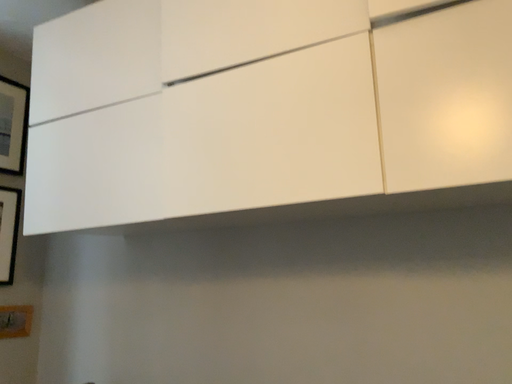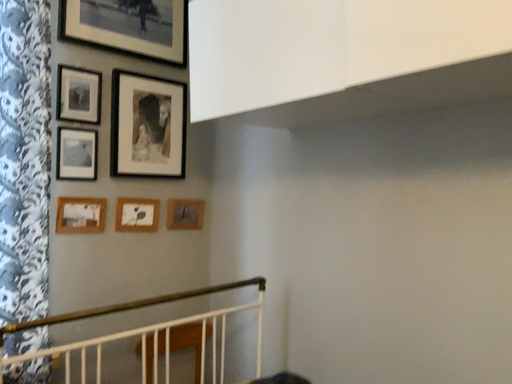
Question: Which way did the camera rotate in the video?

Choices:
 (A) rotated downward
 (B) rotated upward

Answer: (A)